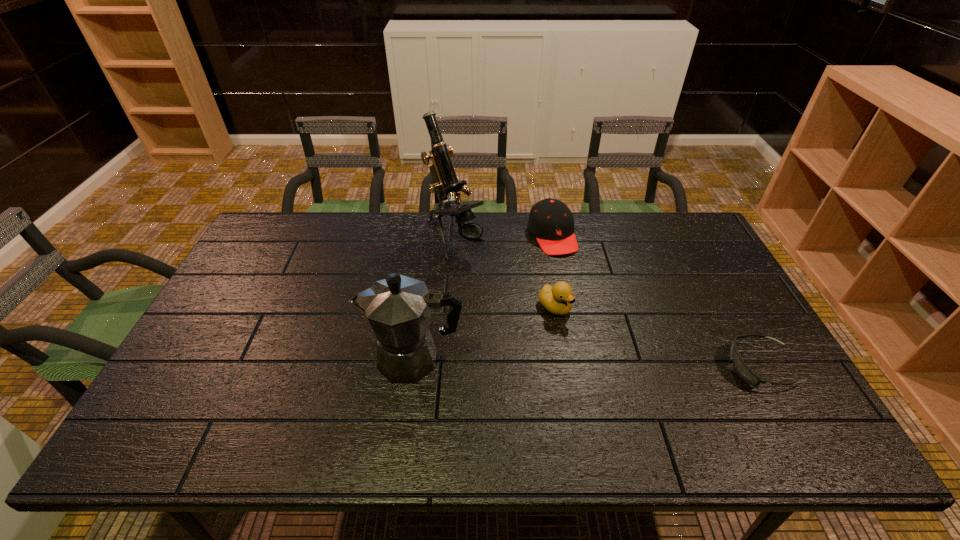
Where is `vacant space located 0.220m on the front-facing side of the cap`? The height and width of the screenshot is (540, 960). vacant space located 0.220m on the front-facing side of the cap is located at coordinates (587, 303).

This screenshot has height=540, width=960. Find the location of `microscope that is at the far edge`. microscope that is at the far edge is located at coordinates (446, 182).

Find the location of a particular element. This screenshot has height=540, width=960. cap located at the far edge is located at coordinates (551, 221).

Identify the location of coffeepot situated at the near edge. (398, 308).

Locate an element on the screen. This screenshot has height=540, width=960. goggles situated at the near edge is located at coordinates (741, 368).

Where is `object present at the right edge`? Image resolution: width=960 pixels, height=540 pixels. object present at the right edge is located at coordinates (741, 368).

Locate an element on the screen. object positioned at the near right corner is located at coordinates (741, 368).

In the image, there is a desktop. In order to click on vacant space at the far edge in this screenshot , I will do `click(334, 253)`.

Where is `blank space at the near edge`? The width and height of the screenshot is (960, 540). blank space at the near edge is located at coordinates (392, 410).

In the image, there is a desktop. Where is `free space at the left edge`? free space at the left edge is located at coordinates (270, 296).